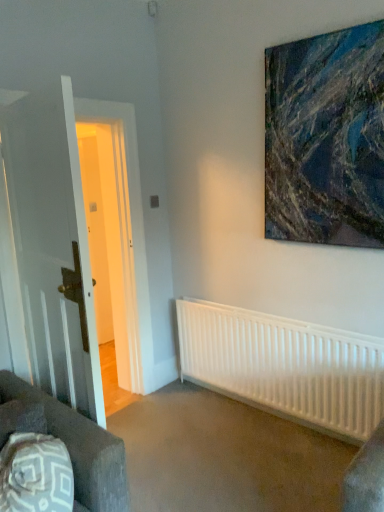
Question: Considering the relative sizes of dark brown fabric couch at lower left and white matte radiator at lower center in the image provided, is dark brown fabric couch at lower left shorter than white matte radiator at lower center?

Choices:
 (A) no
 (B) yes

Answer: (B)

Question: Can you see dark brown fabric couch at lower left touching white matte radiator at lower center?

Choices:
 (A) yes
 (B) no

Answer: (B)

Question: Considering the relative sizes of dark brown fabric couch at lower left and white matte radiator at lower center in the image provided, is dark brown fabric couch at lower left taller than white matte radiator at lower center?

Choices:
 (A) no
 (B) yes

Answer: (A)

Question: Does dark brown fabric couch at lower left have a smaller size compared to white matte radiator at lower center?

Choices:
 (A) no
 (B) yes

Answer: (B)

Question: Does dark brown fabric couch at lower left appear on the right side of white matte radiator at lower center?

Choices:
 (A) yes
 (B) no

Answer: (B)

Question: Considering the relative sizes of dark brown fabric couch at lower left and white matte radiator at lower center in the image provided, is dark brown fabric couch at lower left wider than white matte radiator at lower center?

Choices:
 (A) yes
 (B) no

Answer: (A)

Question: Does abstract painting at upper right touch white wooden door at left?

Choices:
 (A) yes
 (B) no

Answer: (B)

Question: Could you tell me if abstract painting at upper right is facing white wooden door at left?

Choices:
 (A) no
 (B) yes

Answer: (A)

Question: Considering the relative sizes of abstract painting at upper right and white wooden door at left in the image provided, is abstract painting at upper right wider than white wooden door at left?

Choices:
 (A) yes
 (B) no

Answer: (B)

Question: Are abstract painting at upper right and white wooden door at left located far from each other?

Choices:
 (A) no
 (B) yes

Answer: (B)

Question: Does abstract painting at upper right contain white wooden door at left?

Choices:
 (A) no
 (B) yes

Answer: (A)

Question: Does abstract painting at upper right appear on the right side of white wooden door at left?

Choices:
 (A) no
 (B) yes

Answer: (B)

Question: From a real-world perspective, does abstract painting at upper right sit lower than dark brown fabric couch at lower left?

Choices:
 (A) yes
 (B) no

Answer: (B)